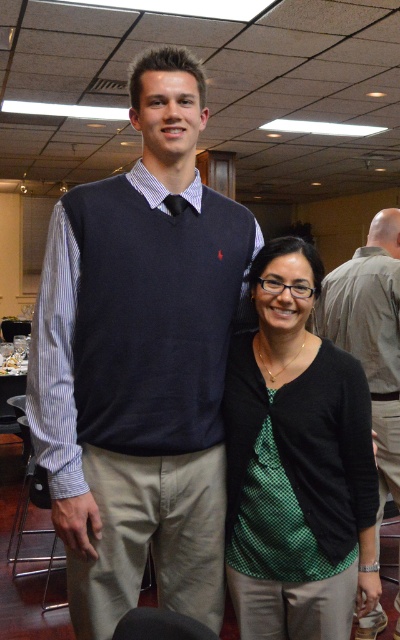
Is green dotted shirt at center above dark blue sweater vest at upper left?

No, green dotted shirt at center is not above dark blue sweater vest at upper left.

Who is more forward, (334,596) or (388,385)?

Positioned in front is point (334,596).

Identify the location of green dotted shirt at center. The height and width of the screenshot is (640, 400). point(295,461).

Based on the photo, who is more forward, (142, 224) or (334, 314)?

Point (142, 224)

Is dark blue sweater vest at center wider than dark blue sweater vest at upper left?

Indeed, dark blue sweater vest at center has a greater width compared to dark blue sweater vest at upper left.

Who is more forward, (200, 493) or (393, 433)?

Positioned in front is point (200, 493).

The width and height of the screenshot is (400, 640). I want to click on dark blue sweater vest at center, so click(x=140, y=362).

Does point (166, 486) come behind point (297, 282)?

No, (166, 486) is in front of (297, 282).

Is dark blue sweater vest at center wider than green dotted shirt at center?

Indeed, dark blue sweater vest at center has a greater width compared to green dotted shirt at center.

Find the location of a particular element. This screenshot has height=640, width=400. dark blue sweater vest at center is located at coordinates (140, 362).

The image size is (400, 640). Find the location of `dark blue sweater vest at center`. dark blue sweater vest at center is located at coordinates (140, 362).